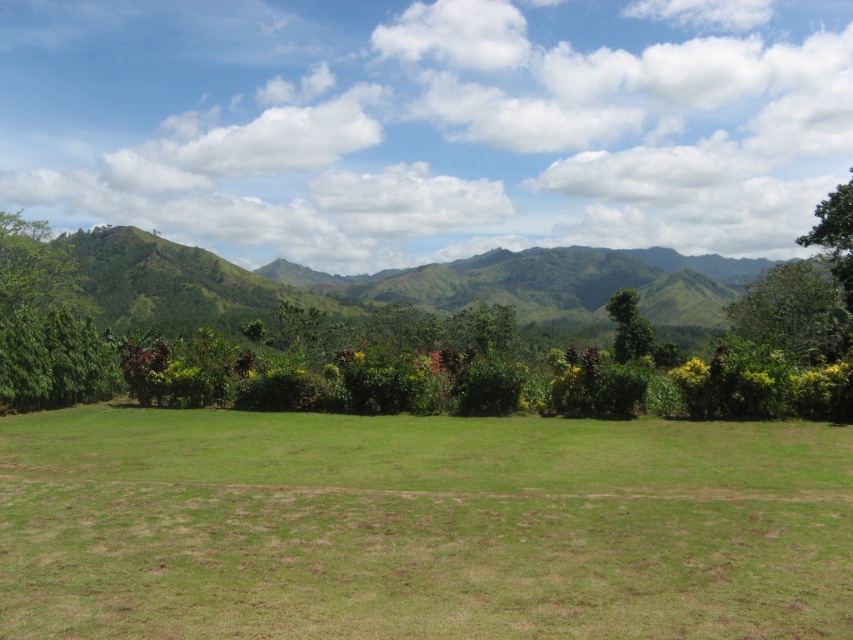
Is point (183, 596) positioned behind point (527, 298)?

No, (183, 596) is in front of (527, 298).

Between point (468, 492) and point (399, 280), which one is positioned in front?

Point (468, 492)

In order to click on green grass at center in this screenshot , I will do `click(421, 525)`.

Consider the image. Does green leafy mountain at center appear over green leafy tree at center?

Yes.

Who is more forward, (111, 236) or (637, 296)?

Positioned in front is point (637, 296).

You are a GUI agent. You are given a task and a screenshot of the screen. Output one action in this format:
    pyautogui.click(x=<x>, y=<y>)
    Task: Click on the green leafy mountain at center
    The image size is (853, 640).
    Given the screenshot: What is the action you would take?
    pyautogui.click(x=405, y=285)

Is green grass at center to the left of green leafy tree at left from the viewer's perspective?

No, green grass at center is not to the left of green leafy tree at left.

Is green grass at center below green leafy tree at left?

Yes, green grass at center is below green leafy tree at left.

Between point (756, 577) and point (38, 237), which one is positioned in front?

Point (756, 577)

Identify the location of green grass at center. This screenshot has width=853, height=640. (421, 525).